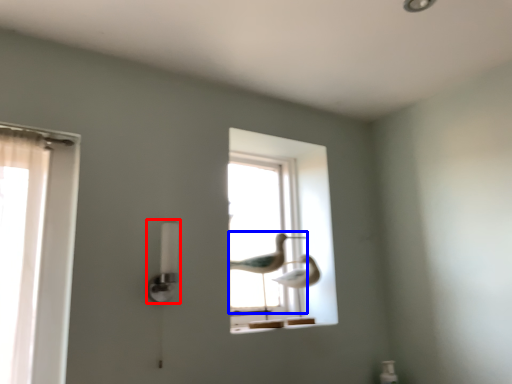
Question: Which object appears closest to the camera in this image, lamp (highlighted by a red box) or bird (highlighted by a blue box)?

Choices:
 (A) lamp
 (B) bird

Answer: (A)